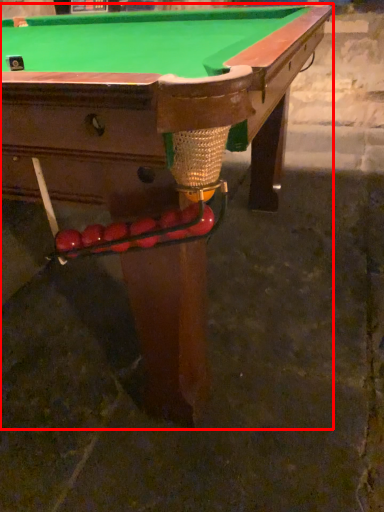
Question: From the image's perspective, where is billiard table (annotated by the red box) located in relation to fruit in the image?

Choices:
 (A) below
 (B) above

Answer: (B)